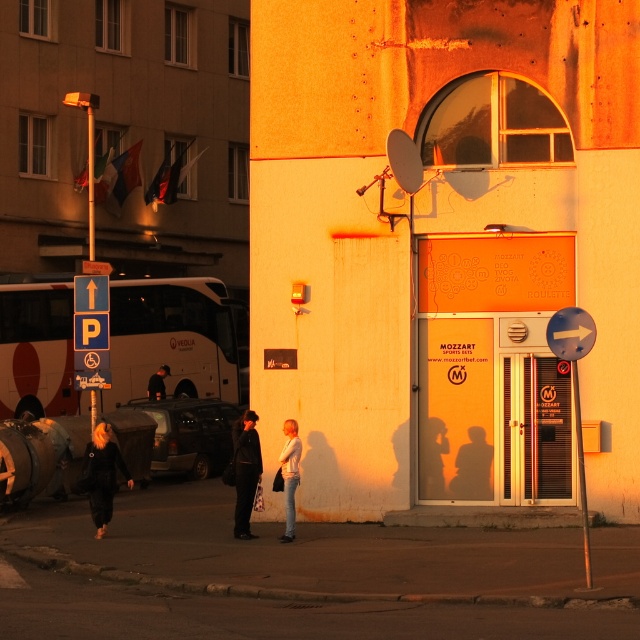
You are a pedestrian standing on the sidewalk and see the white matte bus at left and the dark brown leather jacket at center. Which object is taller?

The white matte bus at left is taller than the dark brown leather jacket at center.

You are a pedestrian standing on the sidewalk and want to cross the street to reach the building with the arched window. The white matte bus at left and the dark brown leather jacket at center are blocking your path. Which object should you move around first?

You should move around the dark brown leather jacket at center first because the white matte bus at left is positioned over it, meaning the bus is further away from you. The jacket is closer to your current position on the sidewalk, so you need to step around it first before proceeding past the bus.

You are a delivery person who needs to park your 2.5 meter wide van between the white matte bus at left and the dark brown leather jacket at center. Can your van fit in the space between them?

The white matte bus at left is wider than the dark brown leather jacket at center. However, the exact distance between them isn not specified, so it is uncertain if the 2.5 meter wide van can fit. Please check the actual space available.